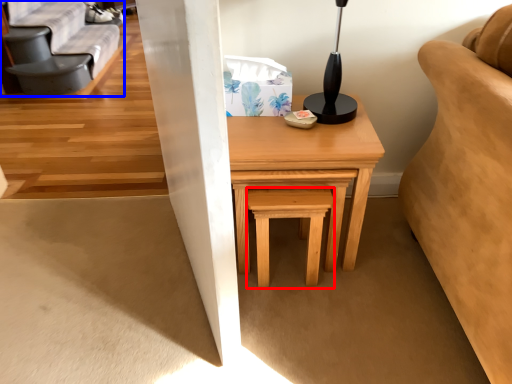
Question: Which of the following is the closest to the observer, stool (highlighted by a red box) or futon (highlighted by a blue box)?

Choices:
 (A) stool
 (B) futon

Answer: (A)